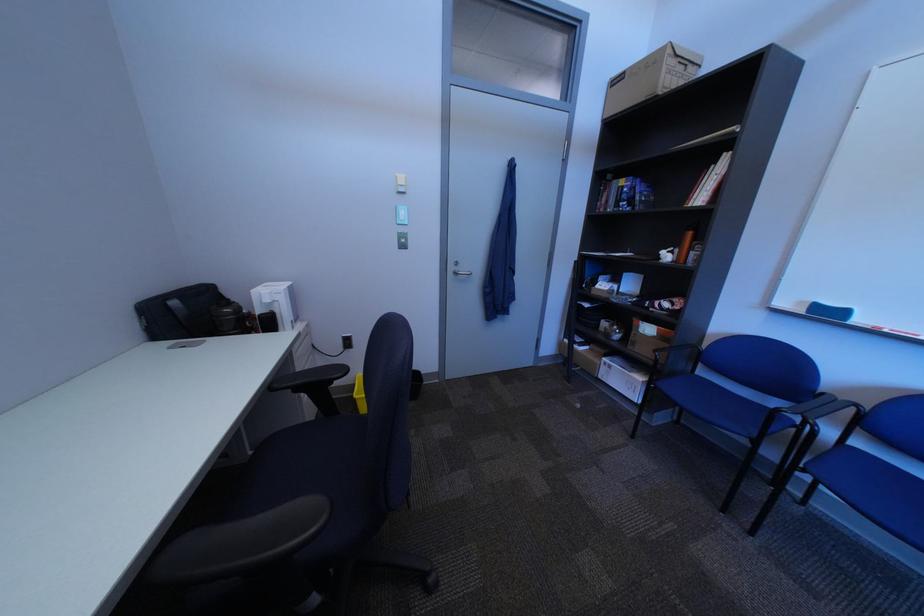
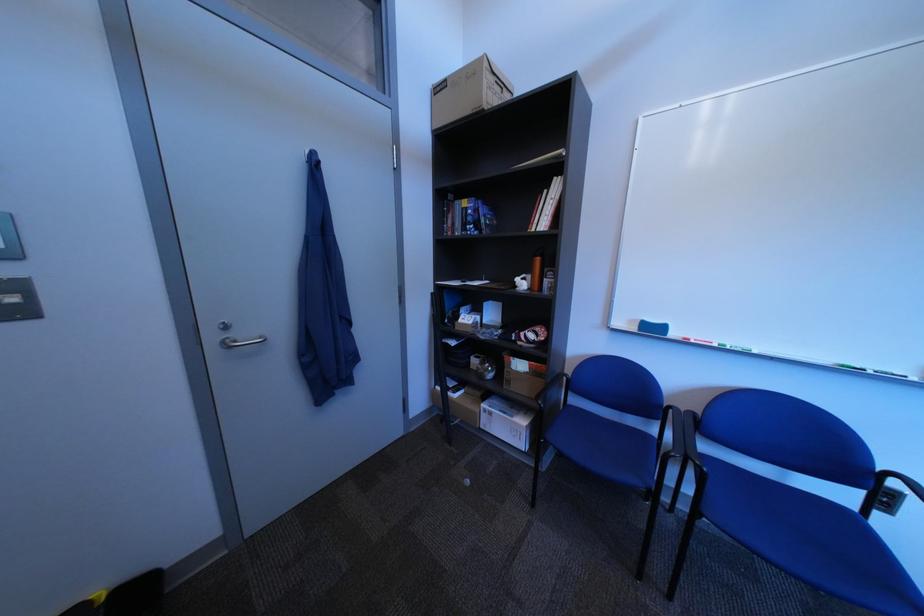
Question: The first image is from the beginning of the video and the second image is from the end. How did the camera likely rotate when shooting the video?

Choices:
 (A) Left
 (B) Right
 (C) Up
 (D) Down

Answer: (B)